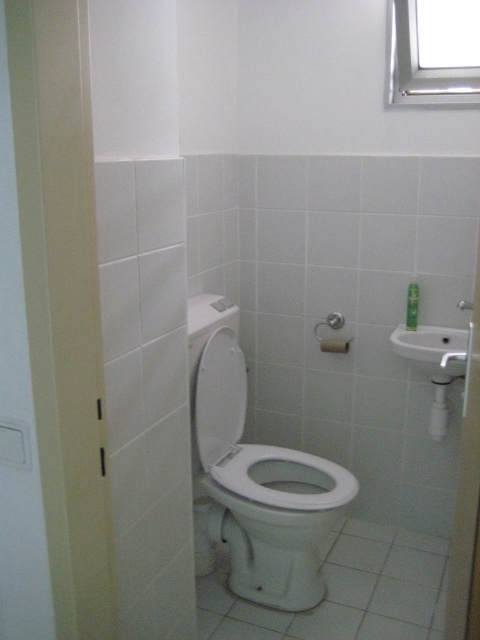
Who is positioned more to the right, white glossy toilet lid at center or white ceramic sink at right?

white ceramic sink at right is more to the right.

Which is behind, point (201, 365) or point (458, 332)?

Positioned behind is point (458, 332).

Find the location of a particular element. This screenshot has width=480, height=640. white glossy toilet lid at center is located at coordinates (219, 397).

Is point (460, 342) farther from camera compared to point (326, 346)?

No, (460, 342) is in front of (326, 346).

Which is more to the right, white ceramic sink at right or white matte toilet paper at center?

white ceramic sink at right

Measure the distance between white ceramic sink at right and camera.

white ceramic sink at right is 6.98 feet from camera.

The height and width of the screenshot is (640, 480). In order to click on white ceramic sink at right in this screenshot , I will do `click(432, 349)`.

Which is in front, point (228, 582) or point (454, 337)?

Point (228, 582) is more forward.

Measure the distance from white glossy toilet bowl at center to white ceramic sink at right.

white glossy toilet bowl at center is 68.91 centimeters from white ceramic sink at right.

Between point (291, 476) and point (424, 337), which one is positioned in front?

Point (291, 476) is more forward.

The width and height of the screenshot is (480, 640). I want to click on white glossy toilet bowl at center, so click(x=275, y=518).